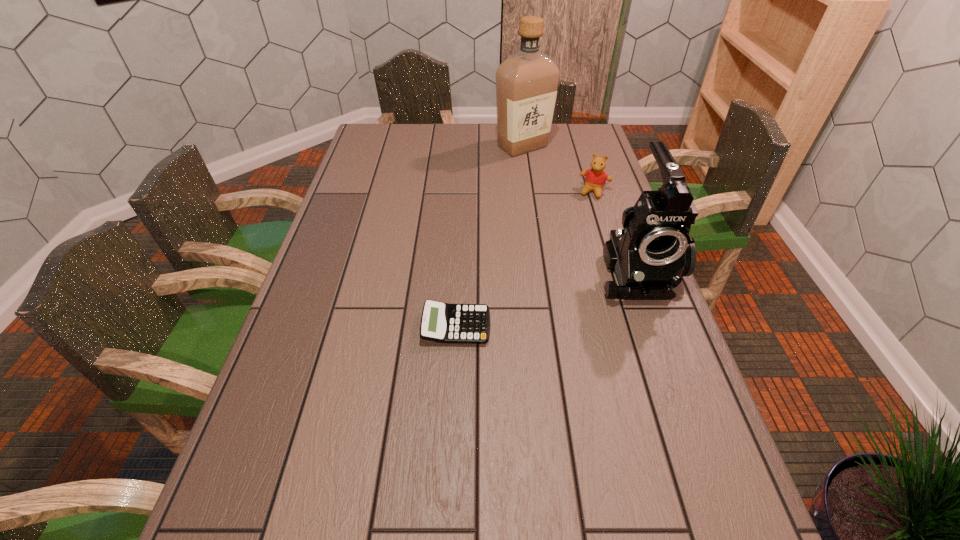
Where is `blank space located on the front-facing side of the third object from right to left`? Image resolution: width=960 pixels, height=540 pixels. blank space located on the front-facing side of the third object from right to left is located at coordinates (527, 206).

Locate an element on the screen. vacant space located on the front-facing side of the third object from right to left is located at coordinates (526, 199).

At what (x,y) coordinates should I click in order to perform the action: click on vacant region located 0.220m on the front-facing side of the third object from right to left. Please return your answer as a coordinate pair (x, y). This screenshot has height=540, width=960. Looking at the image, I should click on (526, 194).

Where is `free spot located on the front-facing side of the third tallest object`? This screenshot has height=540, width=960. free spot located on the front-facing side of the third tallest object is located at coordinates (567, 263).

This screenshot has height=540, width=960. What are the coordinates of `vacant region located on the front-facing side of the third tallest object` in the screenshot? It's located at (573, 248).

This screenshot has height=540, width=960. Find the location of `free space located on the front-facing side of the third tallest object`. free space located on the front-facing side of the third tallest object is located at coordinates (567, 263).

Identify the location of object present at the far edge. (527, 82).

Locate an element on the screen. This screenshot has height=540, width=960. camcorder that is at the right edge is located at coordinates (649, 256).

The width and height of the screenshot is (960, 540). I want to click on teddy bear that is at the right edge, so click(x=595, y=179).

In the image, there is a desktop. Where is `vacant space at the far edge`? vacant space at the far edge is located at coordinates pos(439,137).